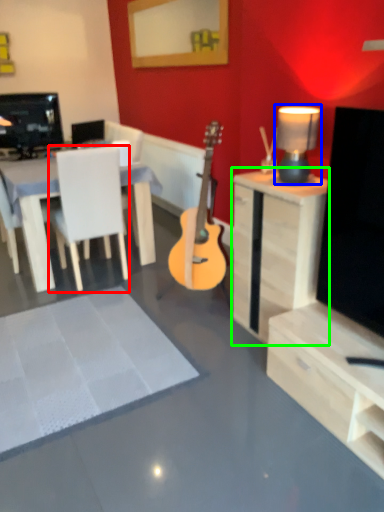
Question: Considering the real-world distances, which object is closest to chair (highlighted by a red box)? lamp (highlighted by a blue box) or desk (highlighted by a green box).

Choices:
 (A) lamp
 (B) desk

Answer: (B)